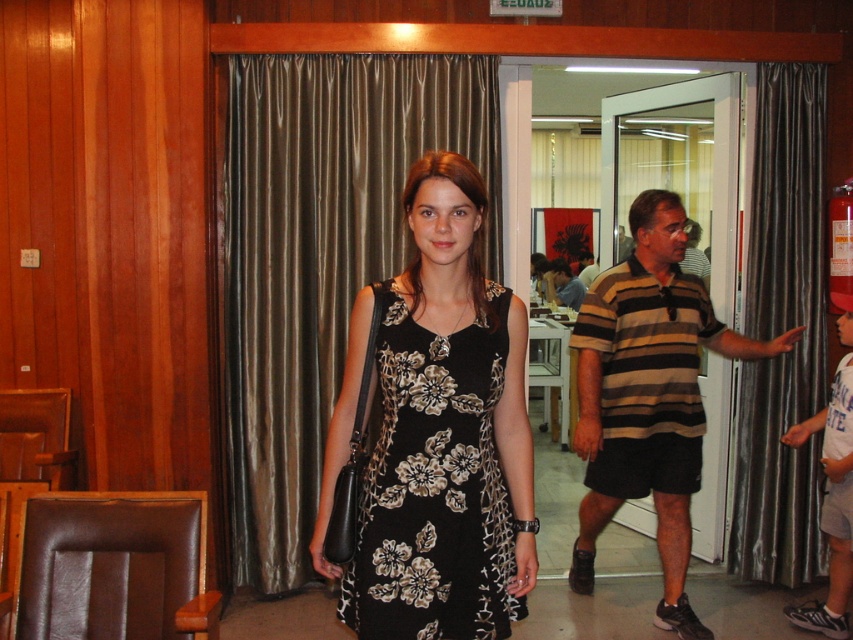
Does silky brown curtain at right appear on the left side of floral fabric dress at center?

Incorrect, silky brown curtain at right is not on the left side of floral fabric dress at center.

Looking at this image, who is lower down, silky brown curtain at right or floral fabric dress at center?

floral fabric dress at center is lower down.

Between point (793, 548) and point (839, 525), which one is positioned in front?

Point (839, 525)

The width and height of the screenshot is (853, 640). What are the coordinates of `silky brown curtain at right` in the screenshot? It's located at (782, 330).

Can you confirm if brown silk curtain at center is taller than striped cotton shirt at center?

Correct, brown silk curtain at center is much taller as striped cotton shirt at center.

Which is more to the left, brown silk curtain at center or striped cotton shirt at center?

From the viewer's perspective, brown silk curtain at center appears more on the left side.

Who is more forward, (286, 432) or (624, 337)?

Point (624, 337) is in front.

I want to click on brown silk curtain at center, so click(321, 257).

Consider the image. Is black floral-patterned dress at center thinner than striped cotton shirt at center?

Correct, black floral-patterned dress at center's width is less than striped cotton shirt at center's.

Who is taller, black floral-patterned dress at center or striped cotton shirt at center?

With more height is striped cotton shirt at center.

Between point (489, 346) and point (619, 305), which one is positioned behind?

Point (619, 305)

The image size is (853, 640). I want to click on black floral-patterned dress at center, so click(x=434, y=484).